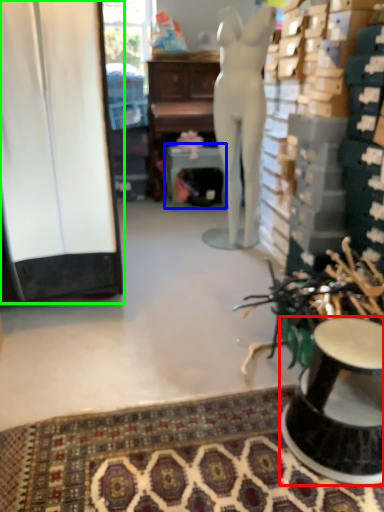
Question: Which is farther away from furniture (highlighted by a red box)? round table (highlighted by a blue box) or cabinetry (highlighted by a green box)?

Choices:
 (A) round table
 (B) cabinetry

Answer: (A)